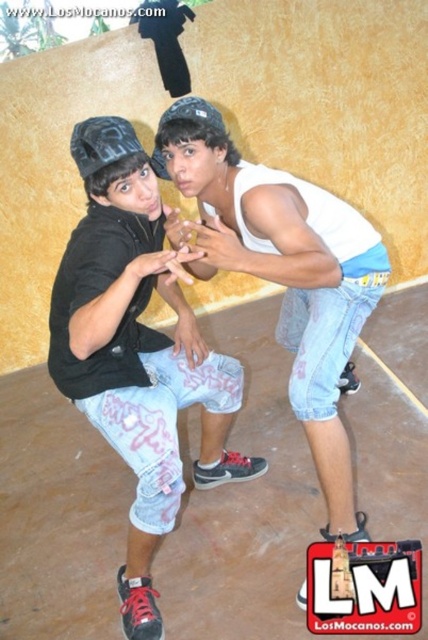
You are a photographer adjusting the lighting for a photo shoot. You need to ensure that the white cotton tank top at upper center and the denim shorts at center are both well lit. Which object should you focus the light on first to ensure proper exposure?

The white cotton tank top at upper center should be focused on first because it is located above the denim shorts at center, so adjusting its lighting will ensure the lower object is also adequately lit.

You are standing between two people in the image. The person on the left is wearing a black zip hoodie and the person on the right is wearing denim shorts at center. If you want to pass between them to reach the wall behind, will there be enough space?

The distance between the person on the left and the denim shorts at center is 1.35 meters. Since you are a person of average width, which is typically around 0.5 meters, there should be enough space to pass between them safely.

You are a fashion designer trying to create a cohesive outfit for a photoshoot. You have to decide whether the denim shorts at center can be paired with the white cotton tank top at upper center based on their widths. Which one is narrower?

The denim shorts at center has a lesser width compared to the white cotton tank top at upper center, so the denim shorts at center is narrower and can be paired together for a cohesive look.